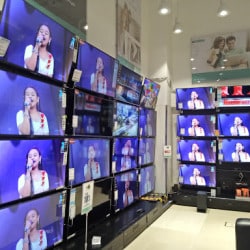
Find the location of a particular element. Image resolution: width=250 pixels, height=250 pixels. floor is located at coordinates (195, 239).